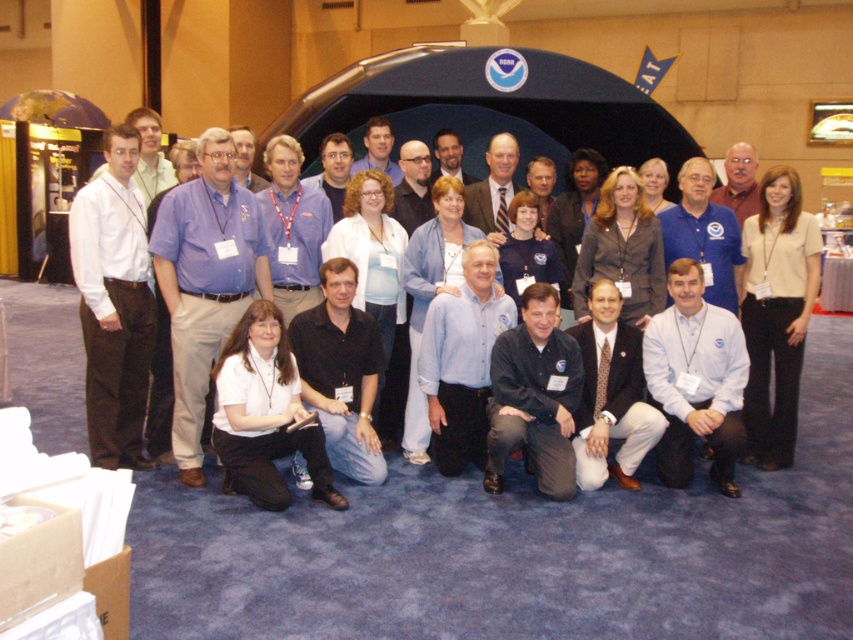
You are a photographer at the event and need to capture a photo where both the white cotton shirt at left and beige fabric shirt at center are visible. Considering their heights, which shirt should be positioned closer to the front of the frame to ensure both are fully visible in the photo?

The beige fabric shirt at center should be positioned closer to the front of the frame because the white cotton shirt at left is taller. This arrangement will ensure that the taller white cotton shirt at left can be seen over the shorter beige fabric shirt at center without blocking it.

You are standing at the entrance of the conference hall and see two people wearing white shirts. One is wearing a white cotton shirt at left and the other a white shirt at center. If you want to approach the person closer to you, which one should you walk towards?

The white cotton shirt at left is 3.48 feet away from the white shirt at center. Since you are at the entrance, the white cotton shirt at left is closer to you than the white shirt at center, so you should walk towards the white cotton shirt at left.

You are standing in the conference hall and need to speak to the person wearing the white cotton shirt at left and the white shirt at center. Which one is closer to you?

The white cotton shirt at left is closer to you because it is in front of the white shirt at center.